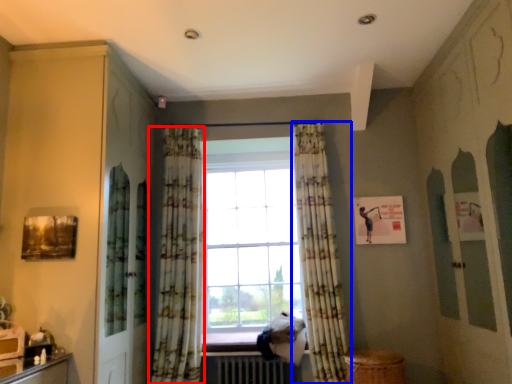
Question: Which object is closer to the camera taking this photo, curtain (highlighted by a red box) or curtain (highlighted by a blue box)?

Choices:
 (A) curtain
 (B) curtain

Answer: (B)